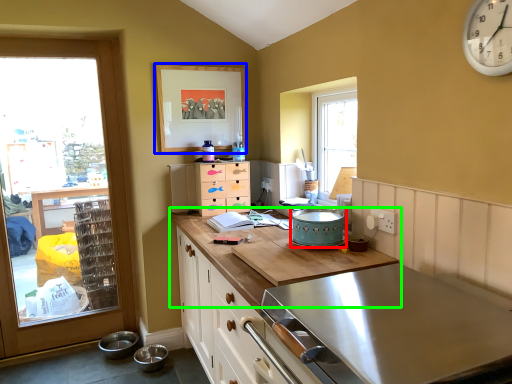
Question: Which object is the farthest from appliance (highlighted by a red box)? Choose among these: picture frame (highlighted by a blue box) or countertop (highlighted by a green box).

Choices:
 (A) picture frame
 (B) countertop

Answer: (A)